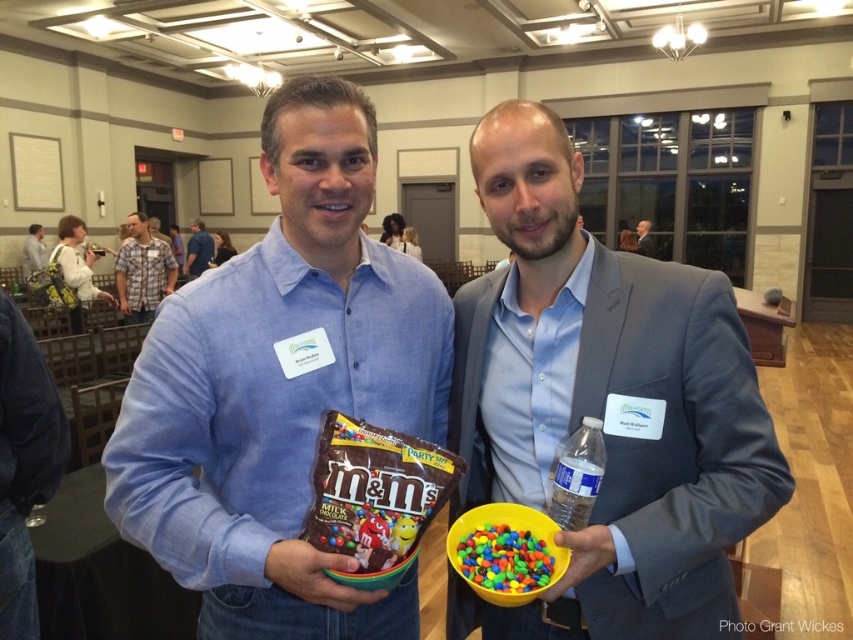
You are organizing a photo shoot and need to ensure that the light blue shirt at center and the dark gray suit at upper right are visible in the frame. Given their sizes, which clothing item requires more horizontal space to fully capture in the photo?

The light blue shirt at center requires more horizontal space because its width surpasses that of the dark gray suit at upper right.

You are a photographer at a networking event. You need to capture a photo of the matte blue shirt at center and the plaid cotton shirt at upper left. Which one is closer to the camera?

The matte blue shirt at center is closer to the camera because it is in front of the plaid cotton shirt at upper left.